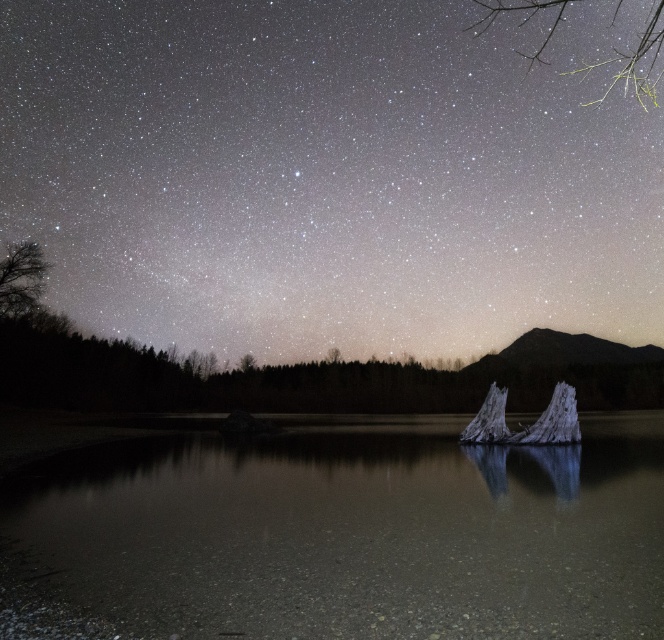
Question: Among these objects, which one is nearest to the camera?

Choices:
 (A) white frosty tree trunk at center-right
 (B) green leafy branches at upper right
 (C) dark brown textured tree at left
 (D) smooth gray tree trunk at center

Answer: (B)

Question: Is dark brown textured tree at left to the right of smooth gray tree trunk at center from the viewer's perspective?

Choices:
 (A) no
 (B) yes

Answer: (A)

Question: Which point is farther to the camera?

Choices:
 (A) white frosty tree trunk at center-right
 (B) green leafy branches at upper right
 (C) clear water at center

Answer: (A)

Question: Is dark brown textured tree at left to the right of smooth gray tree trunk at center from the viewer's perspective?

Choices:
 (A) yes
 (B) no

Answer: (B)

Question: Is the position of clear water at center more distant than that of green leafy branches at upper right?

Choices:
 (A) no
 (B) yes

Answer: (B)

Question: Based on their relative distances, which object is nearer to the dark brown textured tree at left?

Choices:
 (A) smooth gray tree trunk at center
 (B) clear water at center

Answer: (B)